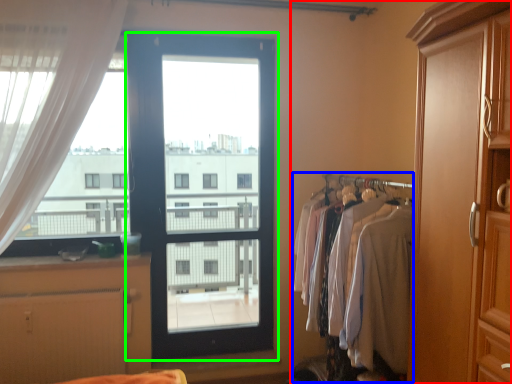
Question: Based on their relative distances, which object is farther from dresser (highlighted by a red box)? Choose from laundry (highlighted by a blue box) and door (highlighted by a green box).

Choices:
 (A) laundry
 (B) door

Answer: (B)